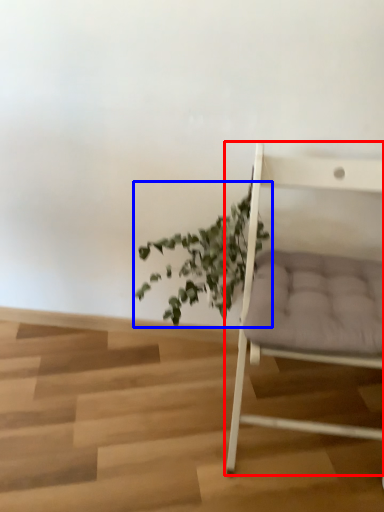
Question: Which of the following is the closest to the observer, chair (highlighted by a red box) or houseplant (highlighted by a blue box)?

Choices:
 (A) chair
 (B) houseplant

Answer: (A)